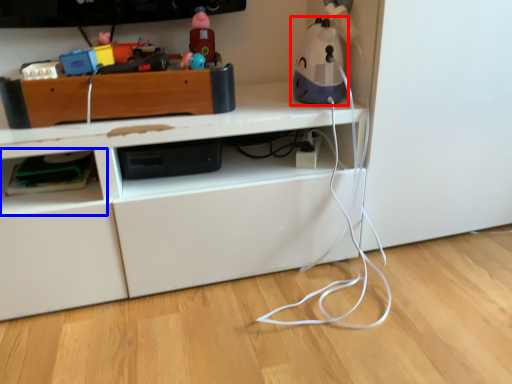
Question: Which object appears farthest to the camera in this image, toy (highlighted by a red box) or shelf (highlighted by a blue box)?

Choices:
 (A) toy
 (B) shelf

Answer: (B)